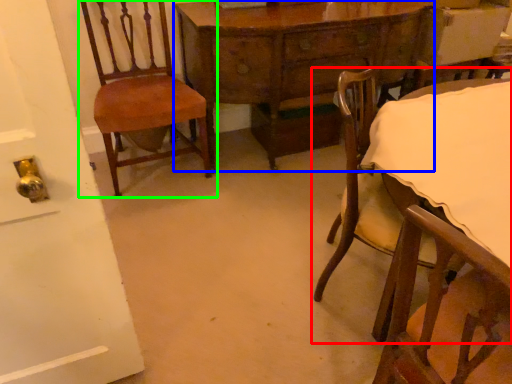
Question: Which object is positioned closest to chair (highlighted by a red box)? Select from table (highlighted by a blue box) and chair (highlighted by a green box).

Choices:
 (A) table
 (B) chair

Answer: (A)